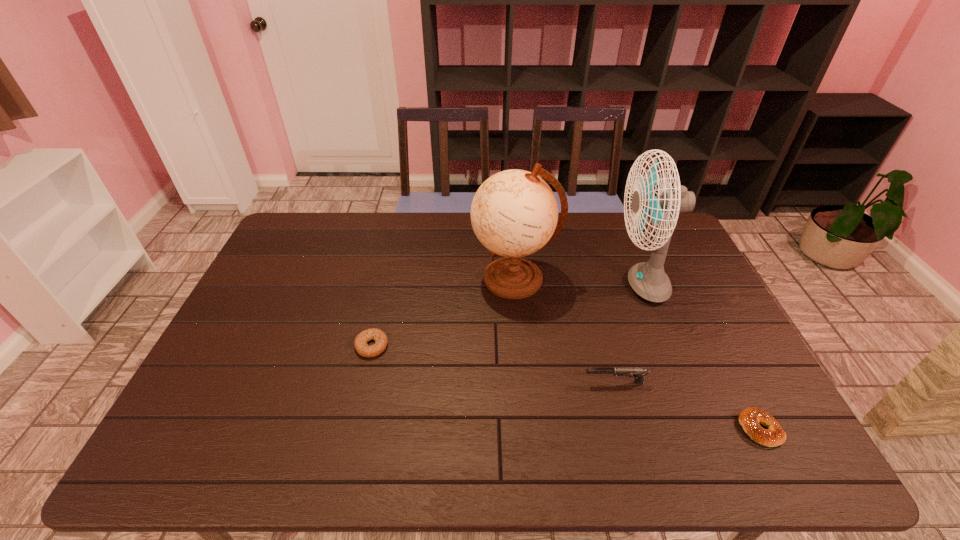
This screenshot has height=540, width=960. I want to click on fan, so click(648, 279).

Find the location of a particular element. The height and width of the screenshot is (540, 960). globe is located at coordinates (514, 213).

Where is `the third shortest object`? This screenshot has width=960, height=540. the third shortest object is located at coordinates (638, 373).

Find the location of a particular element. The width and height of the screenshot is (960, 540). gun is located at coordinates (638, 373).

Find the location of a particular element. This screenshot has width=960, height=540. the left bagel is located at coordinates point(380,338).

Where is `the leftmost object`? The image size is (960, 540). the leftmost object is located at coordinates (380, 338).

At what (x,y) coordinates should I click in order to perform the action: click on the rightmost object. Please return your answer as a coordinate pair (x, y). Image resolution: width=960 pixels, height=540 pixels. Looking at the image, I should click on (749, 418).

The width and height of the screenshot is (960, 540). Identify the location of the nearer bagel. (749, 418).

You are a GUI agent. You are given a task and a screenshot of the screen. Output one action in this format:
    pyautogui.click(x=<x>, y=<y>)
    Task: Click on the vacant region located on the front-facing side of the fan
    This screenshot has height=540, width=960.
    Given the screenshot: What is the action you would take?
    pyautogui.click(x=526, y=285)

At what (x,y) coordinates should I click in order to perform the action: click on vacant area located 0.300m on the front-facing side of the fan. Please return your answer as a coordinate pair (x, y). Looking at the image, I should click on (519, 285).